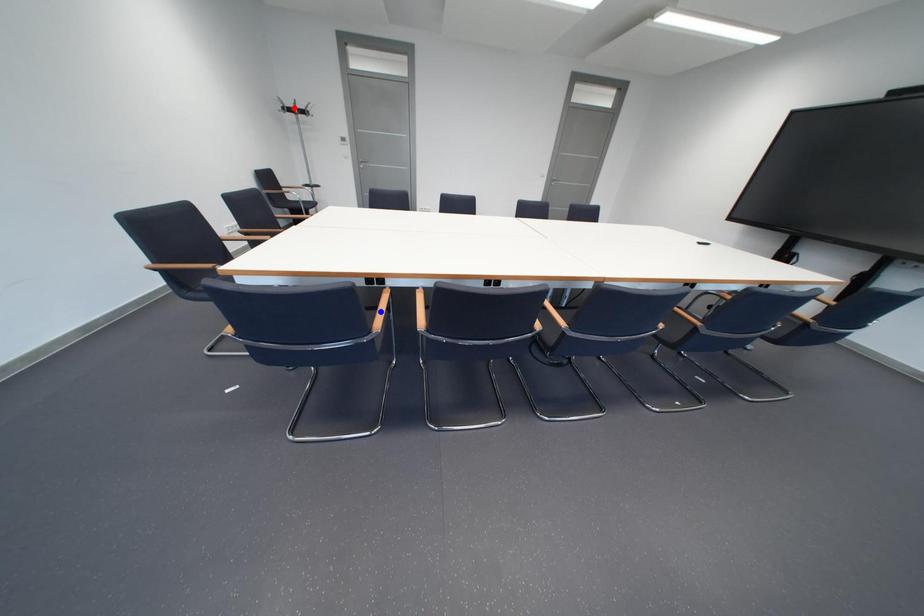
Question: In the image, two points are highlighted. Which point is nearer to the camera? Reply with the corresponding letter.

Choices:
 (A) blue point
 (B) red point

Answer: (A)